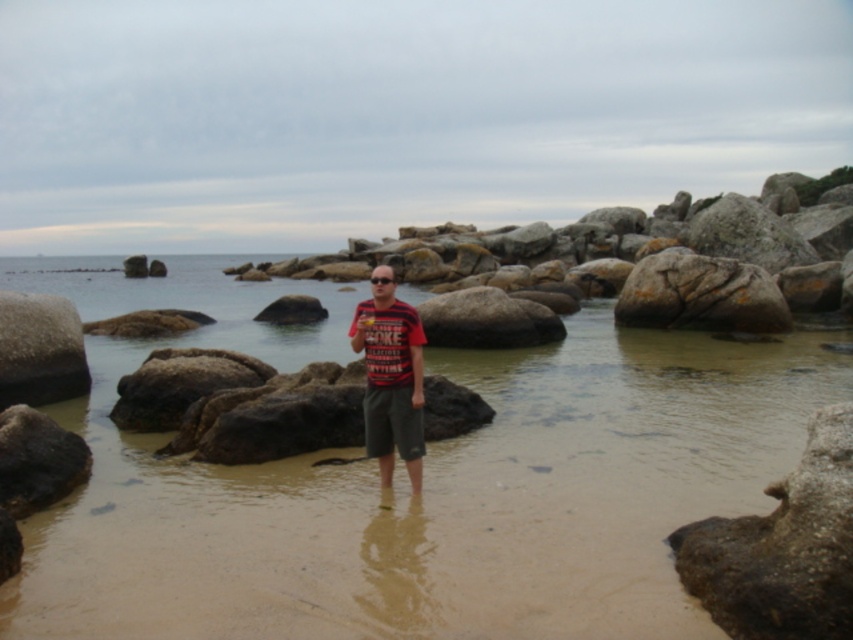
The height and width of the screenshot is (640, 853). Describe the element at coordinates (643, 266) in the screenshot. I see `smooth gray rock at center` at that location.

Is point (573, 269) farther from camera compared to point (851, 550)?

Yes, it is.

Where is `smooth gray rock at center`? This screenshot has width=853, height=640. smooth gray rock at center is located at coordinates (643, 266).

Does brown sand at center have a greater width compared to smooth gray rock at center?

No, brown sand at center is not wider than smooth gray rock at center.

What are the coordinates of `brown sand at center` in the screenshot? It's located at (407, 483).

Locate an element on the screen. The height and width of the screenshot is (640, 853). brown sand at center is located at coordinates (407, 483).

Does point (682, 344) come in front of point (397, 330)?

No, (682, 344) is behind (397, 330).

Can you confirm if brown sand at center is wider than red striped shirt at center?

Correct, the width of brown sand at center exceeds that of red striped shirt at center.

Is point (645, 372) farther from viewer compared to point (380, 458)?

Yes, it is behind point (380, 458).

Where is `brown sand at center`? brown sand at center is located at coordinates (407, 483).